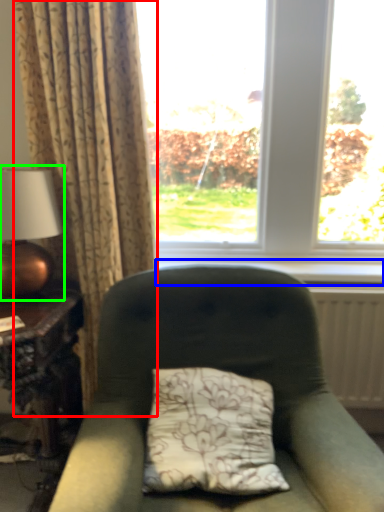
Question: Which object is positioned closest to curtain (highlighted by a red box)? Select from window sill (highlighted by a blue box) and table lamp (highlighted by a green box).

Choices:
 (A) window sill
 (B) table lamp

Answer: (B)